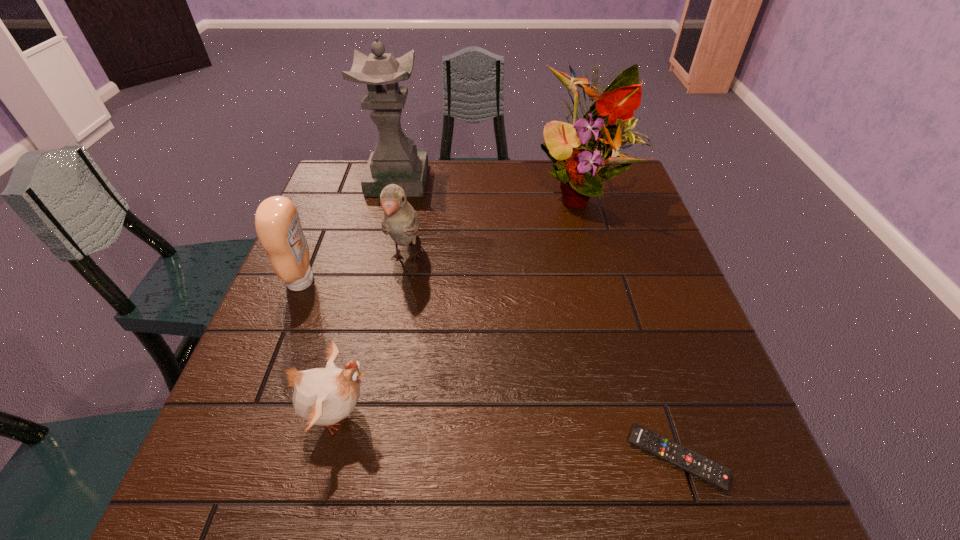
In order to click on free point between the condiment and the shorter bird in this screenshot , I will do `click(320, 348)`.

Find the location of a particular element. This screenshot has width=960, height=540. the fifth closest object to the condiment is located at coordinates (688, 460).

Select which object appears as the fifth closest to the shortest object. Please provide its 2D coordinates. Your answer should be formatted as a tuple, i.e. [(x, y)], where the tuple contains the x and y coordinates of a point satisfying the conditions above.

[(395, 160)]

This screenshot has height=540, width=960. Find the location of `vacant region that satisfies the following two spatial constraints: 1. on the back side of the shortest object; 2. at the front opening of the sculpture`. vacant region that satisfies the following two spatial constraints: 1. on the back side of the shortest object; 2. at the front opening of the sculpture is located at coordinates (589, 180).

The image size is (960, 540). Find the location of `blank space that satisfies the following two spatial constraints: 1. at the face of the taller bird; 2. on the label of the leftmost object`. blank space that satisfies the following two spatial constraints: 1. at the face of the taller bird; 2. on the label of the leftmost object is located at coordinates (402, 281).

In order to click on free space that satisfies the following two spatial constraints: 1. on the back side of the shortest object; 2. at the front opening of the sculpture in this screenshot , I will do `click(589, 180)`.

Where is `vacant space that satisfies the following two spatial constraints: 1. on the back side of the shortest object; 2. on the label of the leftmost object`? The image size is (960, 540). vacant space that satisfies the following two spatial constraints: 1. on the back side of the shortest object; 2. on the label of the leftmost object is located at coordinates pyautogui.click(x=621, y=281).

Find the location of a particular element. This screenshot has height=540, width=960. free location that satisfies the following two spatial constraints: 1. at the face of the taller bird; 2. at the beak of the fifth tallest object is located at coordinates (378, 414).

Identify the location of free spot that satisfies the following two spatial constraints: 1. at the front opening of the shortest object; 2. on the left side of the sculpture. Image resolution: width=960 pixels, height=540 pixels. (331, 457).

You are a GUI agent. You are given a task and a screenshot of the screen. Output one action in this format:
    pyautogui.click(x=<x>, y=<y>)
    Task: Click on the vacant space that satisfies the following two spatial constraints: 1. at the beak of the nearer bird; 2. on the left side of the remote control
    The height and width of the screenshot is (540, 960).
    Given the screenshot: What is the action you would take?
    pyautogui.click(x=328, y=457)